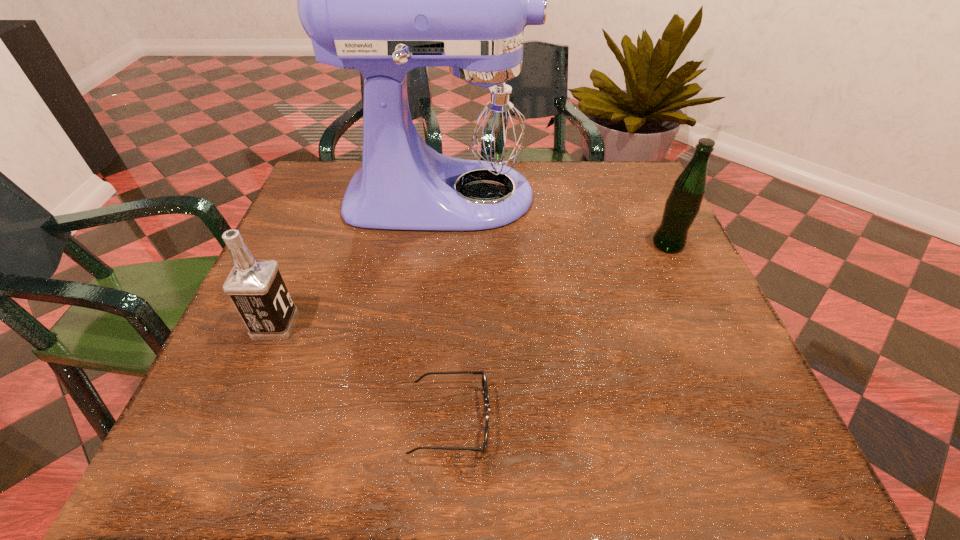
Locate an element on the screen. free location that satisfies the following two spatial constraints: 1. on the front side of the rightmost object; 2. on the front-facing side of the nearest object is located at coordinates (749, 420).